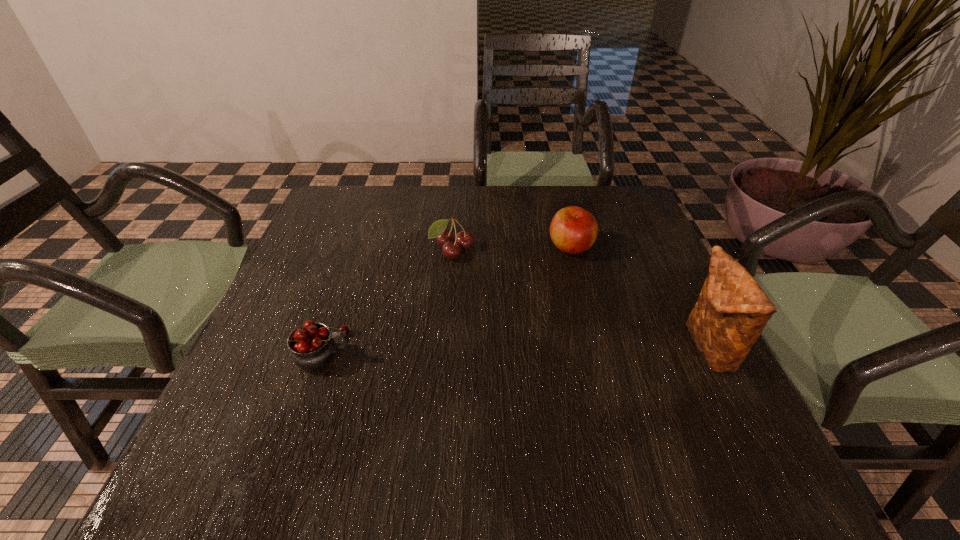
Where is `blank area in the image that satisfies the following two spatial constraints: 1. on the front side of the shorter cherry; 2. on the open side of the clutch bag`? This screenshot has height=540, width=960. blank area in the image that satisfies the following two spatial constraints: 1. on the front side of the shorter cherry; 2. on the open side of the clutch bag is located at coordinates (444, 348).

This screenshot has height=540, width=960. I want to click on free point that satisfies the following two spatial constraints: 1. on the front side of the tallest object; 2. on the open side of the second object from left to right, so click(444, 348).

Locate an element on the screen. The height and width of the screenshot is (540, 960). free space that satisfies the following two spatial constraints: 1. on the front side of the third object from left to right; 2. on the open side of the rightmost object is located at coordinates (596, 348).